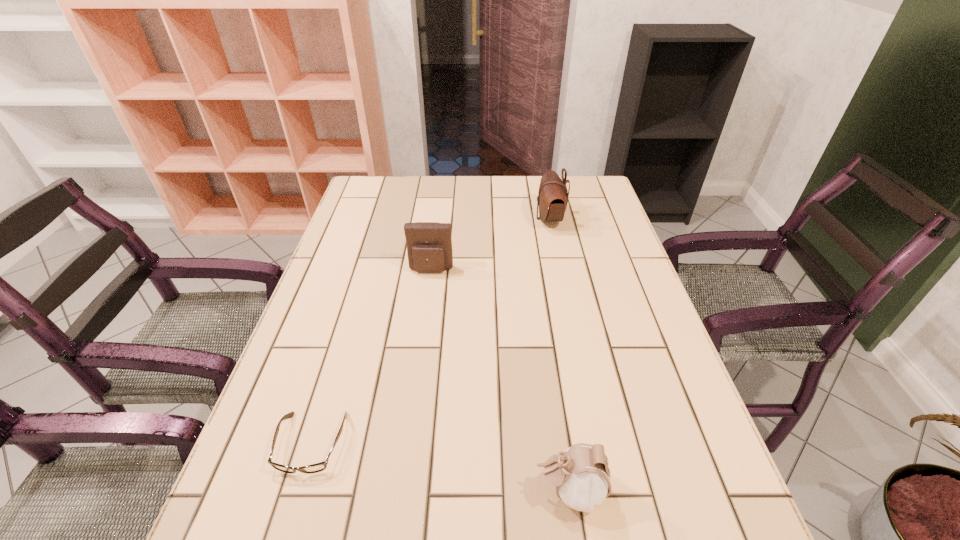
The width and height of the screenshot is (960, 540). What are the coordinates of `unoccupied area between the second object from left to right and the shortest object` in the screenshot? It's located at (372, 357).

Choose which object is the third nearest neighbor to the nearest pouch. Please provide its 2D coordinates. Your answer should be formatted as a tuple, i.e. [(x, y)], where the tuple contains the x and y coordinates of a point satisfying the conditions above.

[(552, 198)]

Select which object appears as the closest to the third nearest object. Please provide its 2D coordinates. Your answer should be formatted as a tuple, i.e. [(x, y)], where the tuple contains the x and y coordinates of a point satisfying the conditions above.

[(552, 198)]

Locate which pouch is the closest to the leftmost object. Please provide its 2D coordinates. Your answer should be formatted as a tuple, i.e. [(x, y)], where the tuple contains the x and y coordinates of a point satisfying the conditions above.

[(581, 475)]

At what (x,y) coordinates should I click in order to perform the action: click on pouch that is the second closest one to the farthest object. Please return your answer as a coordinate pair (x, y). The width and height of the screenshot is (960, 540). Looking at the image, I should click on (581, 475).

Find the location of a particular element. The image size is (960, 540). vacant area in the image that satisfies the following two spatial constraints: 1. with the flap open on the farthest pouch; 2. on the front-facing side of the spectacles is located at coordinates (597, 443).

The width and height of the screenshot is (960, 540). Find the location of `vacant point that satisfies the following two spatial constraints: 1. with the flap open on the farthest object; 2. on the front-facing side of the leftmost object`. vacant point that satisfies the following two spatial constraints: 1. with the flap open on the farthest object; 2. on the front-facing side of the leftmost object is located at coordinates (597, 443).